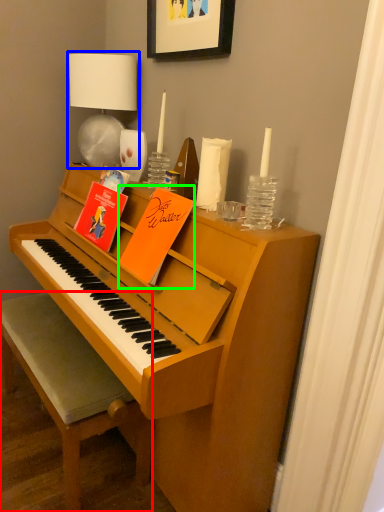
Question: Estimate the real-world distances between objects in this image. Which object is farther from chair (highlighted by a red box), table lamp (highlighted by a blue box) or paperback book (highlighted by a green box)?

Choices:
 (A) table lamp
 (B) paperback book

Answer: (A)